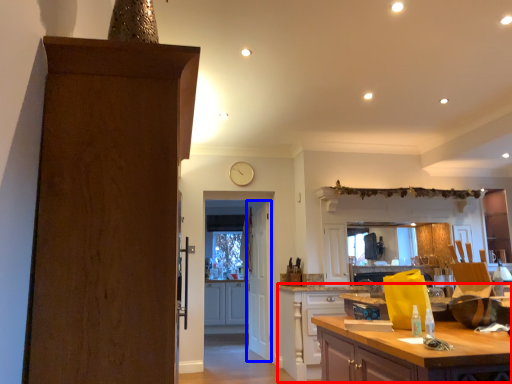
Question: Which of the following is the closest to the observer, cabinetry (highlighted by a red box) or door (highlighted by a blue box)?

Choices:
 (A) cabinetry
 (B) door

Answer: (A)